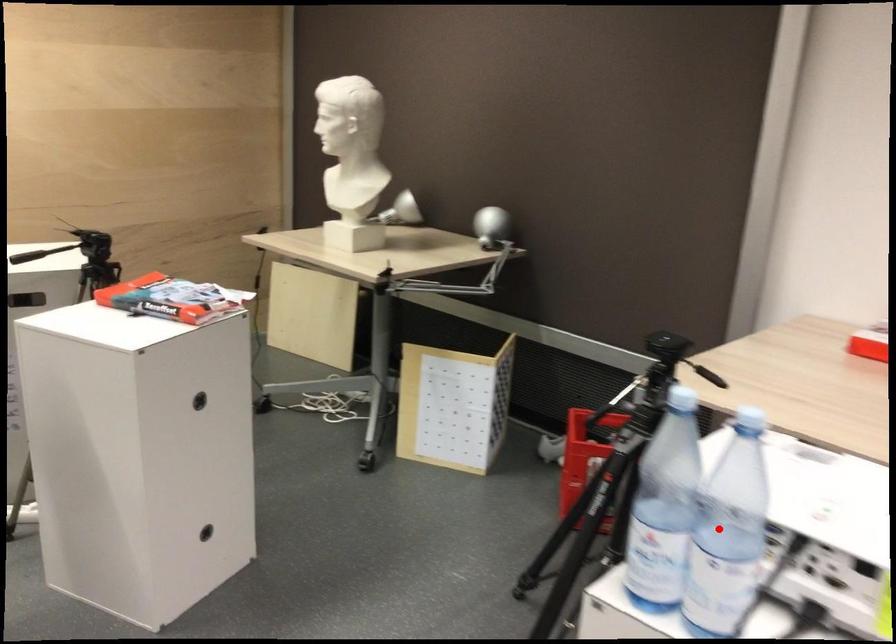
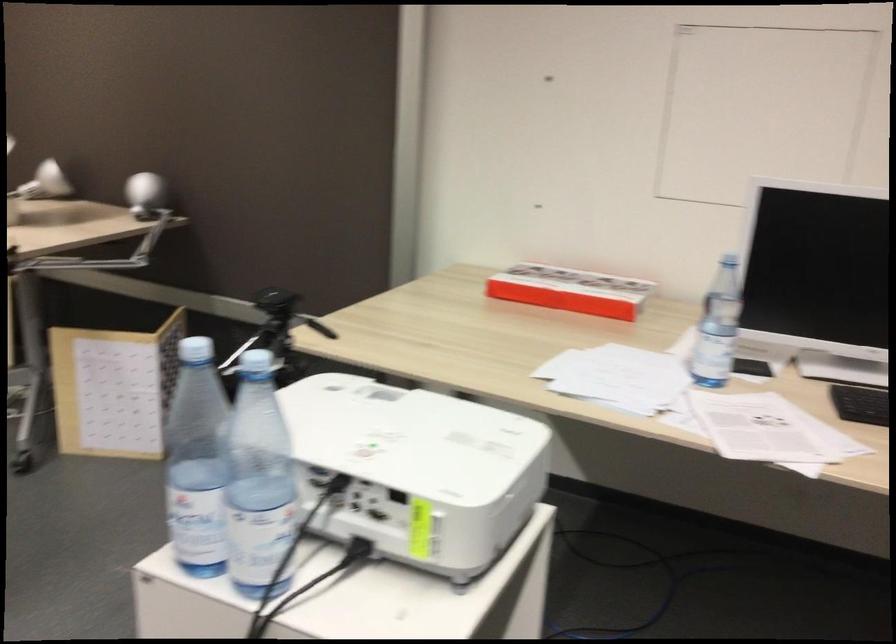
Question: I am providing you with two images of the same scene from different viewpoints. A red point is marked on the first image. Can you still see the location of the red point in image 2?

Choices:
 (A) Yes
 (B) No

Answer: (A)